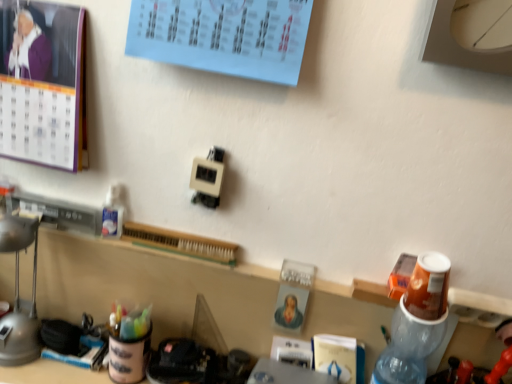
Question: Can you confirm if translucent plastic bottle at right is smaller than purple paper calendar at upper left?

Choices:
 (A) yes
 (B) no

Answer: (A)

Question: Considering the relative sizes of translucent plastic bottle at right and purple paper calendar at upper left in the image provided, is translucent plastic bottle at right bigger than purple paper calendar at upper left?

Choices:
 (A) no
 (B) yes

Answer: (A)

Question: Is the depth of translucent plastic bottle at right less than that of purple paper calendar at upper left?

Choices:
 (A) no
 (B) yes

Answer: (B)

Question: From the image's perspective, would you say translucent plastic bottle at right is positioned over purple paper calendar at upper left?

Choices:
 (A) yes
 (B) no

Answer: (B)

Question: Does translucent plastic bottle at right touch purple paper calendar at upper left?

Choices:
 (A) yes
 (B) no

Answer: (B)

Question: From the image's perspective, is translucent plastic bottle at right positioned above or below matte gray lamp at left?

Choices:
 (A) above
 (B) below

Answer: (B)

Question: In terms of size, does translucent plastic bottle at right appear bigger or smaller than matte gray lamp at left?

Choices:
 (A) small
 (B) big

Answer: (B)

Question: Is translucent plastic bottle at right to the left or to the right of matte gray lamp at left in the image?

Choices:
 (A) left
 (B) right

Answer: (B)

Question: Is translucent plastic bottle at right spatially inside matte gray lamp at left, or outside of it?

Choices:
 (A) outside
 (B) inside

Answer: (A)

Question: Is point (3, 240) positioned closer to the camera than point (434, 261)?

Choices:
 (A) farther
 (B) closer

Answer: (A)

Question: Is matte gray lamp at left in front of or behind translucent plastic bottle at right in the image?

Choices:
 (A) front
 (B) behind

Answer: (B)

Question: In terms of width, does matte gray lamp at left look wider or thinner when compared to translucent plastic bottle at right?

Choices:
 (A) wide
 (B) thin

Answer: (B)

Question: In terms of height, does matte gray lamp at left look taller or shorter compared to translucent plastic bottle at right?

Choices:
 (A) tall
 (B) short

Answer: (B)

Question: Is matte gray lamp at left in front of or behind purple paper calendar at upper left in the image?

Choices:
 (A) behind
 (B) front

Answer: (A)

Question: From a real-world perspective, relative to purple paper calendar at upper left, is matte gray lamp at left vertically above or below?

Choices:
 (A) above
 (B) below

Answer: (B)